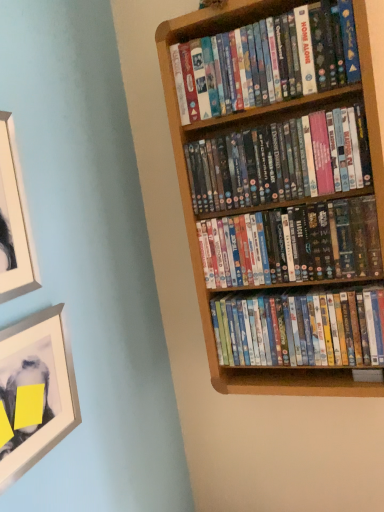
Question: Considering the positions of white matte picture frame at upper left, arranged as the second picture frame when ordered from the bottom, and multicolored plastic dvds at center, the first book when ordered from bottom to top, in the image, is white matte picture frame at upper left, arranged as the second picture frame when ordered from the bottom, bigger or smaller than multicolored plastic dvds at center, the first book when ordered from bottom to top,?

Choices:
 (A) small
 (B) big

Answer: (A)

Question: From the image's perspective, relative to multicolored plastic dvds at center, arranged as the fourth book when viewed from the top, is white matte picture frame at upper left, arranged as the second picture frame when ordered from the bottom, above or below?

Choices:
 (A) below
 (B) above

Answer: (B)

Question: Based on their relative distances, which object is nearer to the matte plastic dvds at upper right, which is the second book from top to bottom?

Choices:
 (A) metallic silver picture frame at lower left, which is the 1th picture frame in bottom-to-top order
 (B) light brown wood bookcase at upper right
 (C) multicolored plastic dvds at center, the 2th book from the bottom
 (D) matte cardboard book at upper right, the 1th book from the top
 (E) white matte picture frame at upper left, arranged as the 1th picture frame when viewed from the top

Answer: (C)

Question: Which of these objects is positioned closest to the light brown wood bookcase at upper right?

Choices:
 (A) matte cardboard book at upper right, the 1th book from the top
 (B) matte plastic dvds at upper right, which is the second book from top to bottom
 (C) multicolored plastic dvds at center, arranged as the fourth book when viewed from the top
 (D) white matte picture frame at upper left, arranged as the 1th picture frame when viewed from the top
 (E) multicolored plastic dvds at center, the 2th book from the bottom

Answer: (A)